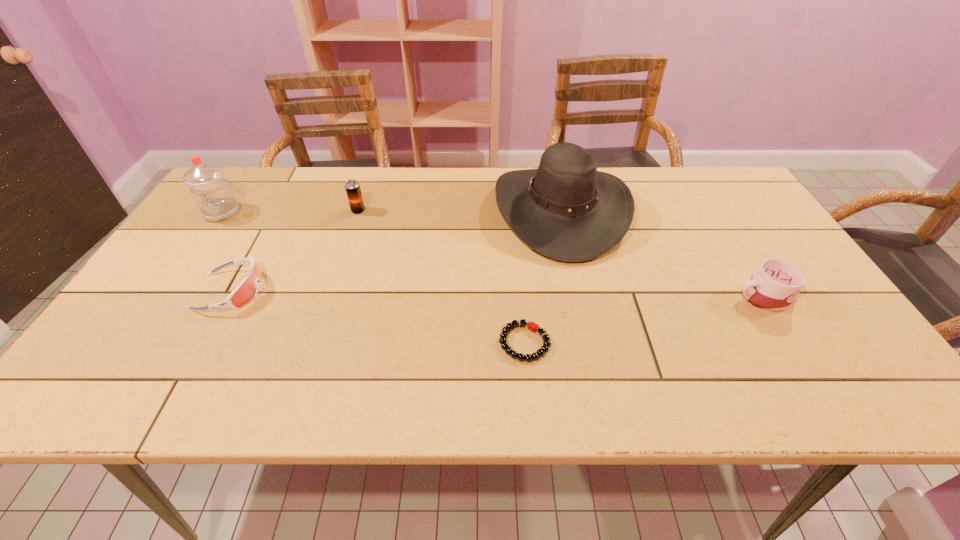
Image resolution: width=960 pixels, height=540 pixels. I want to click on free space between the fifth object from right to left and the water bottle, so (x=226, y=252).

Locate an element on the screen. The height and width of the screenshot is (540, 960). the fifth closest object to the bracelet is located at coordinates (213, 196).

This screenshot has height=540, width=960. What are the coordinates of `object that is the fifth closest to the nearest object` in the screenshot? It's located at (213, 196).

I want to click on vacant area in the image that satisfies the following two spatial constraints: 1. on the front-facing side of the nearest object; 2. on the left side of the goggles, so click(202, 342).

Identify the location of vacant region that satisfies the following two spatial constraints: 1. on the side with the handle of the mug; 2. on the front side of the nearest object. The width and height of the screenshot is (960, 540). (792, 342).

The height and width of the screenshot is (540, 960). Identify the location of vacant area in the image that satisfies the following two spatial constraints: 1. on the front-facing side of the shortest object; 2. on the right side of the goggles. [x=202, y=342].

Identify the location of free spot that satisfies the following two spatial constraints: 1. on the front-facing side of the cowboy hat; 2. on the front side of the nearest object. (589, 342).